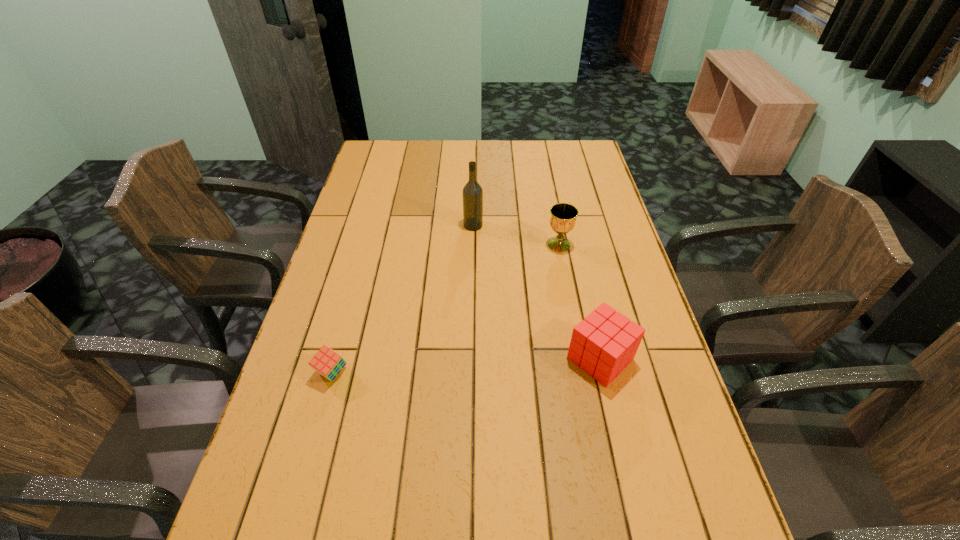
Find the location of a particular element. This screenshot has height=540, width=960. the tallest object is located at coordinates (472, 192).

Locate an element on the screen. The image size is (960, 540). vodka is located at coordinates pos(472,192).

The width and height of the screenshot is (960, 540). Identify the location of the second farthest object. (563, 216).

Where is `the right cube`? Image resolution: width=960 pixels, height=540 pixels. the right cube is located at coordinates (604, 343).

The height and width of the screenshot is (540, 960). I want to click on the left cube, so click(x=327, y=362).

Locate an element on the screen. This screenshot has height=540, width=960. the shorter cube is located at coordinates (327, 362).

Find the location of a particular element. This screenshot has height=540, width=960. vacant space situated on the right of the vodka is located at coordinates (599, 225).

The image size is (960, 540). I want to click on blank space located 0.090m on the left of the chalice, so click(517, 245).

What are the coordinates of `vacant space situated 0.140m on the front of the right cube` in the screenshot? It's located at (620, 446).

This screenshot has height=540, width=960. What are the coordinates of `vacant area situated 0.280m on the front of the shorter cube` in the screenshot? It's located at (292, 518).